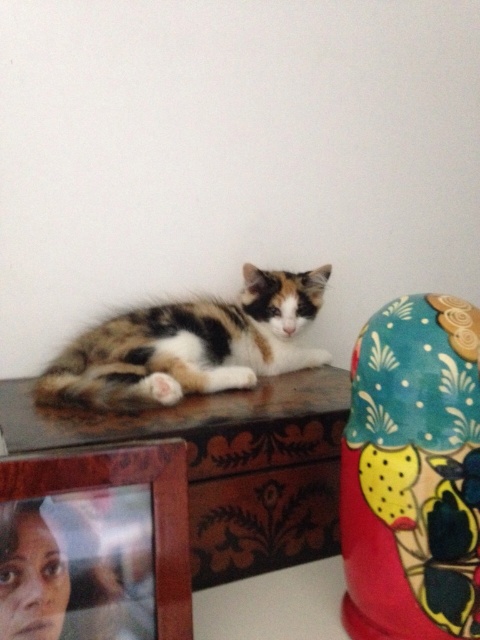
Question: Is the position of wooden carved table at center less distant than that of calico fur cat at center?

Choices:
 (A) no
 (B) yes

Answer: (B)

Question: Considering the relative positions of wooden carved table at center and calico fur cat at center in the image provided, where is wooden carved table at center located with respect to calico fur cat at center?

Choices:
 (A) below
 (B) above

Answer: (A)

Question: Is wooden carved table at center below calico fur cat at center?

Choices:
 (A) yes
 (B) no

Answer: (A)

Question: Among these objects, which one is farthest from the camera?

Choices:
 (A) wooden carved table at center
 (B) calico fur cat at center

Answer: (B)

Question: Among these points, which one is farthest from the camera?

Choices:
 (A) (264, 502)
 (B) (205, 387)

Answer: (B)

Question: Which point is closer to the camera taking this photo?

Choices:
 (A) (216, 476)
 (B) (220, 378)

Answer: (A)